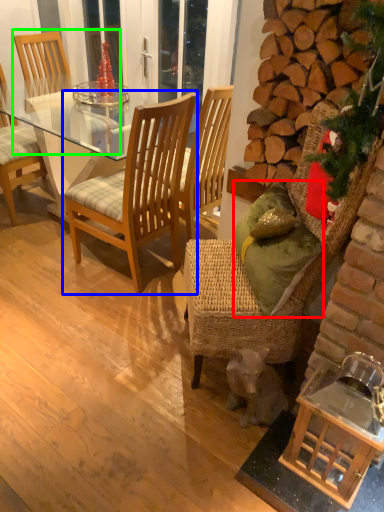
Question: Based on their relative distances, which object is nearer to pillow (highlighted by a red box)? Choose from chair (highlighted by a blue box) and chair (highlighted by a green box).

Choices:
 (A) chair
 (B) chair

Answer: (A)